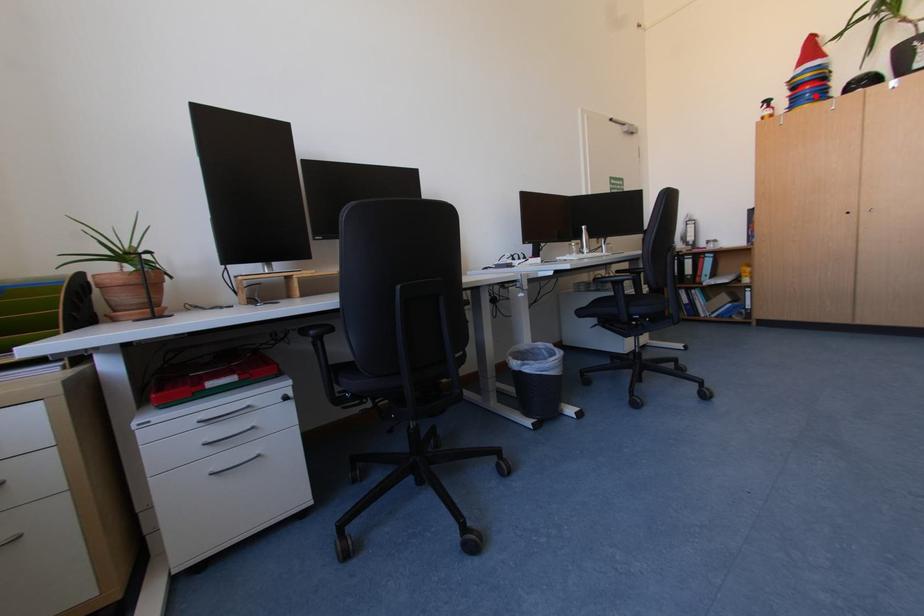
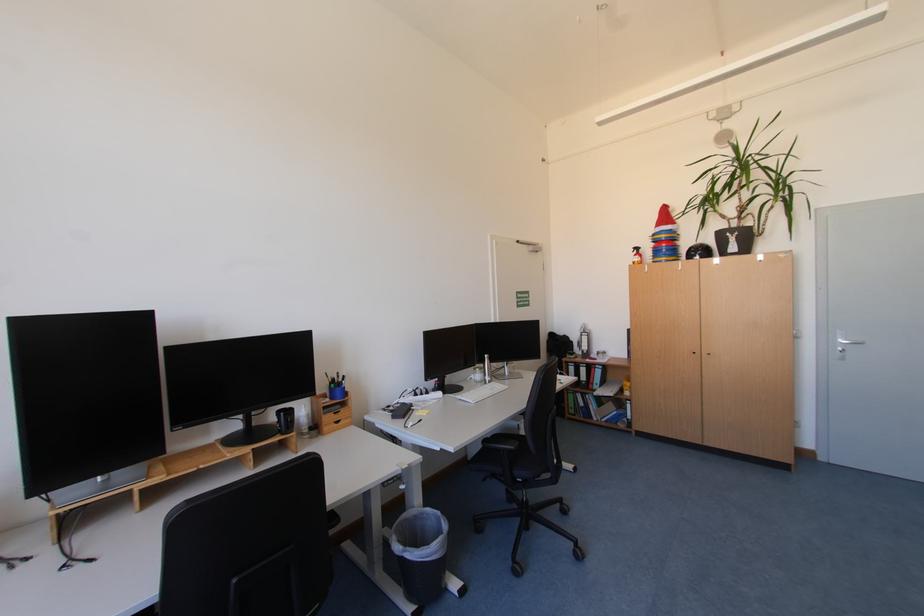
Locate, in the second image, the point that corresponds to the highlighted location in the first image.

(672, 252)